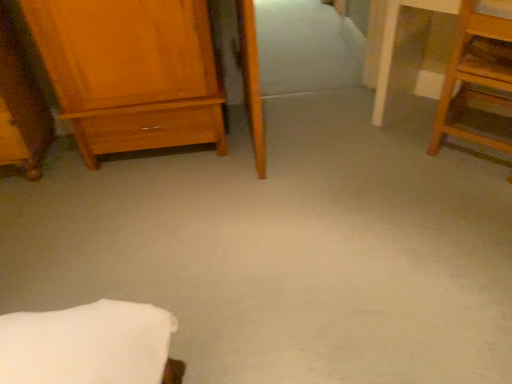
Question: From a real-world perspective, is wooden wardrobe at left, the second furniture viewed from the right, under wooden step stool at right, acting as the first furniture starting from the right?

Choices:
 (A) no
 (B) yes

Answer: (A)

Question: Is wooden step stool at right, acting as the first furniture starting from the right, at the back of wooden wardrobe at left, which ranks as the 1th furniture in left-to-right order?

Choices:
 (A) no
 (B) yes

Answer: (A)

Question: Can you see wooden wardrobe at left, which ranks as the 1th furniture in left-to-right order, touching wooden step stool at right, which is the 2th furniture from left to right?

Choices:
 (A) no
 (B) yes

Answer: (A)

Question: Is wooden wardrobe at left, which ranks as the 1th furniture in left-to-right order, to the right of wooden step stool at right, acting as the first furniture starting from the right, from the viewer's perspective?

Choices:
 (A) yes
 (B) no

Answer: (B)

Question: Is wooden wardrobe at left, the second furniture viewed from the right, bigger than wooden step stool at right, which is the 2th furniture from left to right?

Choices:
 (A) yes
 (B) no

Answer: (A)

Question: Is wooden step stool at right, which is the 2th furniture from left to right, in front of or behind matte wood chest of drawers at left in the image?

Choices:
 (A) behind
 (B) front

Answer: (B)

Question: In terms of size, does wooden step stool at right, acting as the first furniture starting from the right, appear bigger or smaller than matte wood chest of drawers at left?

Choices:
 (A) small
 (B) big

Answer: (A)

Question: Based on their positions, is wooden step stool at right, which is the 2th furniture from left to right, located to the left or right of matte wood chest of drawers at left?

Choices:
 (A) right
 (B) left

Answer: (A)

Question: Is wooden step stool at right, acting as the first furniture starting from the right, inside the boundaries of matte wood chest of drawers at left, or outside?

Choices:
 (A) outside
 (B) inside

Answer: (A)

Question: Which is correct: wooden wardrobe at left, the second furniture viewed from the right, is inside matte wood chest of drawers at left, or outside of it?

Choices:
 (A) outside
 (B) inside

Answer: (A)

Question: In terms of height, does wooden wardrobe at left, which ranks as the 1th furniture in left-to-right order, look taller or shorter compared to matte wood chest of drawers at left?

Choices:
 (A) short
 (B) tall

Answer: (A)

Question: Considering the positions of point (18, 129) and point (100, 107), is point (18, 129) closer or farther from the camera than point (100, 107)?

Choices:
 (A) farther
 (B) closer

Answer: (A)

Question: From a real-world perspective, is wooden wardrobe at left, which ranks as the 1th furniture in left-to-right order, positioned above or below matte wood chest of drawers at left?

Choices:
 (A) below
 (B) above

Answer: (A)

Question: Looking at the image, does matte wood chest of drawers at left seem bigger or smaller compared to wooden step stool at right, acting as the first furniture starting from the right?

Choices:
 (A) big
 (B) small

Answer: (A)

Question: Is matte wood chest of drawers at left taller or shorter than wooden step stool at right, acting as the first furniture starting from the right?

Choices:
 (A) tall
 (B) short

Answer: (A)